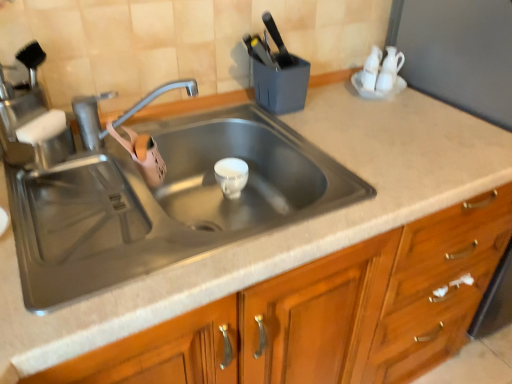
Question: Should I look upward or downward to see stainless steel sink at center?

Choices:
 (A) up
 (B) down

Answer: (B)

Question: Should I look upward or downward to see satin nickel faucet at upper left?

Choices:
 (A) down
 (B) up

Answer: (B)

Question: Does stainless steel sink at center appear on the left side of wooden cabinet at center?

Choices:
 (A) no
 (B) yes

Answer: (B)

Question: From a real-world perspective, is stainless steel sink at center positioned over wooden cabinet at center based on gravity?

Choices:
 (A) no
 (B) yes

Answer: (B)

Question: Is stainless steel sink at center wider than wooden cabinet at center?

Choices:
 (A) no
 (B) yes

Answer: (A)

Question: Is there a large distance between stainless steel sink at center and wooden cabinet at center?

Choices:
 (A) yes
 (B) no

Answer: (B)

Question: Could you tell me if stainless steel sink at center is facing wooden cabinet at center?

Choices:
 (A) yes
 (B) no

Answer: (A)

Question: Considering the relative sizes of stainless steel sink at center and wooden cabinet at center in the image provided, is stainless steel sink at center smaller than wooden cabinet at center?

Choices:
 (A) yes
 (B) no

Answer: (A)

Question: Is wooden cabinet at center in front of satin nickel faucet at upper left?

Choices:
 (A) yes
 (B) no

Answer: (A)

Question: Does wooden cabinet at center have a smaller size compared to satin nickel faucet at upper left?

Choices:
 (A) yes
 (B) no

Answer: (B)

Question: Does wooden cabinet at center lie behind satin nickel faucet at upper left?

Choices:
 (A) yes
 (B) no

Answer: (B)

Question: Is wooden cabinet at center oriented away from satin nickel faucet at upper left?

Choices:
 (A) yes
 (B) no

Answer: (B)

Question: Is satin nickel faucet at upper left completely or partially inside wooden cabinet at center?

Choices:
 (A) no
 (B) yes

Answer: (A)

Question: Does wooden cabinet at center have a greater height compared to satin nickel faucet at upper left?

Choices:
 (A) no
 (B) yes

Answer: (B)

Question: Can we say wooden cabinet at center lies outside stainless steel sink at center?

Choices:
 (A) yes
 (B) no

Answer: (A)